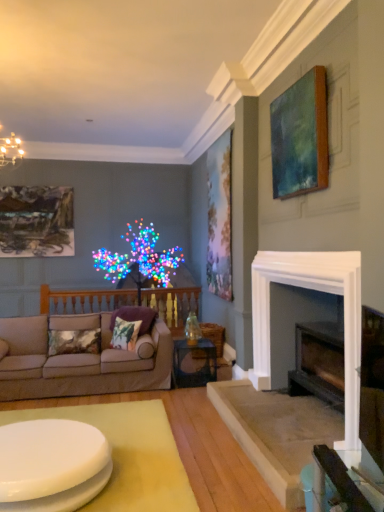
Question: Is purple velvet pillow at center, placed as the 1th pillow when sorted from right to left, at the right side of white glossy coffee table at center?

Choices:
 (A) no
 (B) yes

Answer: (B)

Question: Are purple velvet pillow at center, the 3th pillow viewed from the left, and white glossy coffee table at center making contact?

Choices:
 (A) yes
 (B) no

Answer: (B)

Question: From the image's perspective, is purple velvet pillow at center, the 3th pillow viewed from the left, on top of white glossy coffee table at center?

Choices:
 (A) yes
 (B) no

Answer: (A)

Question: Can you confirm if purple velvet pillow at center, the 3th pillow viewed from the left, is bigger than white glossy coffee table at center?

Choices:
 (A) no
 (B) yes

Answer: (A)

Question: Is purple velvet pillow at center, the 3th pillow viewed from the left, looking in the opposite direction of white glossy coffee table at center?

Choices:
 (A) no
 (B) yes

Answer: (A)

Question: From a real-world perspective, does purple velvet pillow at center, the 3th pillow viewed from the left, stand above white glossy coffee table at center?

Choices:
 (A) no
 (B) yes

Answer: (B)

Question: From the image's perspective, is greenish-blue canvas at upper right, which is the third picture frame in back-to-front order, on top of green printed fabric pillow at center, which is the second pillow in right-to-left order?

Choices:
 (A) no
 (B) yes

Answer: (B)

Question: Is green printed fabric pillow at center, which is the second pillow in right-to-left order, located within greenish-blue canvas at upper right, which is the 1th picture frame in front-to-back order?

Choices:
 (A) yes
 (B) no

Answer: (B)

Question: Considering the relative sizes of greenish-blue canvas at upper right, which appears as the first picture frame when viewed from the right, and green printed fabric pillow at center, which ranks as the 2th pillow in left-to-right order, in the image provided, is greenish-blue canvas at upper right, which appears as the first picture frame when viewed from the right, thinner than green printed fabric pillow at center, which ranks as the 2th pillow in left-to-right order,?

Choices:
 (A) no
 (B) yes

Answer: (B)

Question: Can we say greenish-blue canvas at upper right, which is the 1th picture frame in front-to-back order, lies outside green printed fabric pillow at center, which is the second pillow in right-to-left order?

Choices:
 (A) no
 (B) yes

Answer: (B)

Question: Is the depth of greenish-blue canvas at upper right, which is the 3th picture frame in left-to-right order, less than that of green printed fabric pillow at center, which is the second pillow in right-to-left order?

Choices:
 (A) yes
 (B) no

Answer: (A)

Question: Does greenish-blue canvas at upper right, which is the 3th picture frame in left-to-right order, have a lesser height compared to green printed fabric pillow at center, which is the second pillow in right-to-left order?

Choices:
 (A) yes
 (B) no

Answer: (B)

Question: Can you confirm if beige fabric couch at left is shorter than purple velvet pillow at center, the 3th pillow viewed from the left?

Choices:
 (A) yes
 (B) no

Answer: (B)